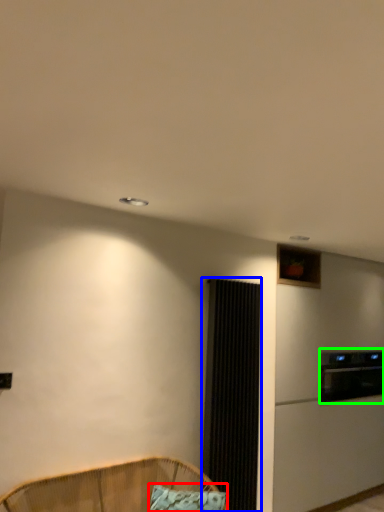
Question: Which object is positioned farthest from pillow (highlighted by a red box)? Select from screen door (highlighted by a blue box) and appliance (highlighted by a green box).

Choices:
 (A) screen door
 (B) appliance

Answer: (B)